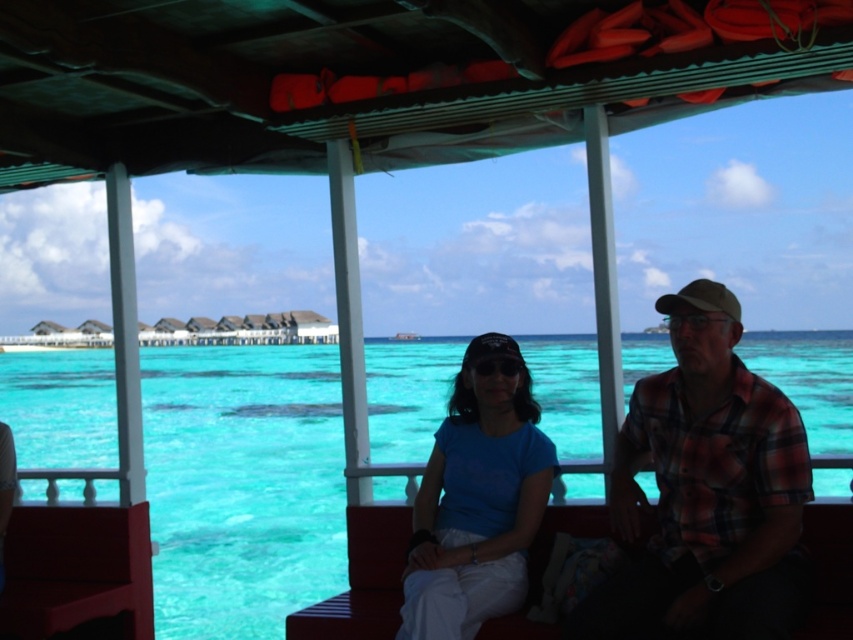
Between turquoise clear water at center and plaid fabric shirt at right, which one is positioned lower?

Positioned lower is turquoise clear water at center.

Is point (157, 621) positioned after point (706, 600)?

Yes, it is.

This screenshot has width=853, height=640. Identify the location of turquoise clear water at center. (242, 484).

Locate an element on the screen. plaid fabric shirt at right is located at coordinates (706, 492).

Which is behind, point (712, 566) or point (426, 541)?

The point (426, 541) is behind.

Is point (699, 470) more distant than point (454, 500)?

No, (699, 470) is closer to viewer.

Find the location of `plaid fabric shirt at right`. plaid fabric shirt at right is located at coordinates (706, 492).

Locate an element on the screen. The height and width of the screenshot is (640, 853). turquoise clear water at center is located at coordinates (242, 484).

Between point (271, 394) and point (486, 531), which one is positioned behind?

The point (271, 394) is more distant.

The image size is (853, 640). What are the coordinates of `turquoise clear water at center` in the screenshot? It's located at (x=242, y=484).

Where is `turquoise clear water at center`? turquoise clear water at center is located at coordinates (242, 484).